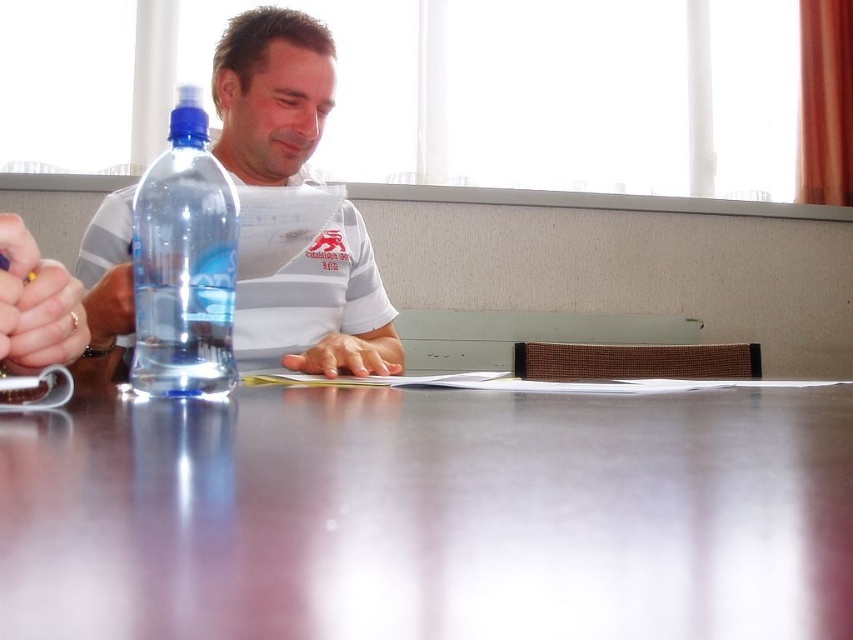
You are standing in front of the table and want to place a small object on the table. If you want to place it closer to the camera, which point should you choose between point (561,522) and point (148,353)?

Point (561,522) is closer to the camera than point (148,353), so you should choose point (561,522) to place the object closer to the camera.

From the picture: You are a photographer trying to capture the reflection of the water bottle on the glossy plastic table at center. The camera is positioned at a certain distance. Can you estimate whether the reflection will be clearly visible given the table is 4.13 inches away from the camera?

The glossy plastic table at center is 4.13 inches from the camera, so the reflection of the water bottle on it should be clearly visible as the distance is close enough to capture details.